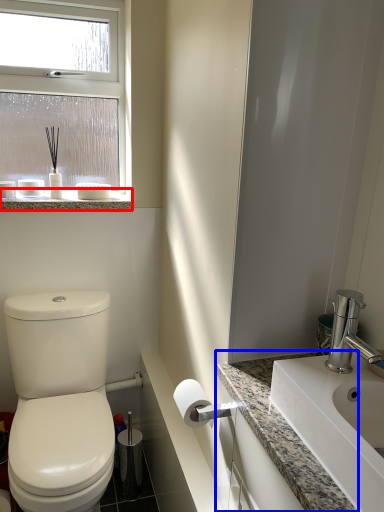
Question: Which of the following is the closest to the observer, window sill (highlighted by a red box) or counter top (highlighted by a blue box)?

Choices:
 (A) window sill
 (B) counter top

Answer: (B)